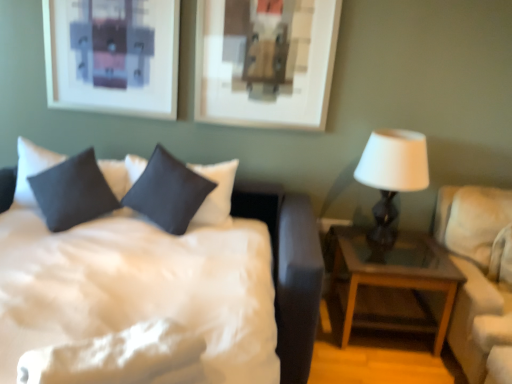
Question: Considering the relative positions of beige fabric couch at right and satin dark blue pillow at center, arranged as the 2th pillow when viewed from the left, in the image provided, is beige fabric couch at right to the left of satin dark blue pillow at center, arranged as the 2th pillow when viewed from the left, from the viewer's perspective?

Choices:
 (A) no
 (B) yes

Answer: (A)

Question: Is beige fabric couch at right closer to camera compared to satin dark blue pillow at center, arranged as the 2th pillow when viewed from the left?

Choices:
 (A) yes
 (B) no

Answer: (A)

Question: Could you tell me if beige fabric couch at right is turned towards satin dark blue pillow at center, arranged as the 2th pillow when viewed from the left?

Choices:
 (A) no
 (B) yes

Answer: (A)

Question: Can we say beige fabric couch at right lies outside satin dark blue pillow at center, placed as the 1th pillow when sorted from right to left?

Choices:
 (A) no
 (B) yes

Answer: (B)

Question: From the image's perspective, is beige fabric couch at right located above satin dark blue pillow at center, arranged as the 2th pillow when viewed from the left?

Choices:
 (A) no
 (B) yes

Answer: (A)

Question: Would you say dark gray fabric pillow at upper left, marked as the first pillow in a left-to-right arrangement, is to the left or to the right of white matte table lamp at right in the picture?

Choices:
 (A) left
 (B) right

Answer: (A)

Question: Based on their sizes in the image, would you say dark gray fabric pillow at upper left, marked as the first pillow in a left-to-right arrangement, is bigger or smaller than white matte table lamp at right?

Choices:
 (A) small
 (B) big

Answer: (B)

Question: Considering the positions of dark gray fabric pillow at upper left, marked as the first pillow in a left-to-right arrangement, and white matte table lamp at right in the image, is dark gray fabric pillow at upper left, marked as the first pillow in a left-to-right arrangement, taller or shorter than white matte table lamp at right?

Choices:
 (A) tall
 (B) short

Answer: (B)

Question: Is point (84, 180) closer or farther from the camera than point (382, 208)?

Choices:
 (A) farther
 (B) closer

Answer: (B)

Question: Would you say dark gray fabric pillow at upper left, which ranks as the second pillow in right-to-left order, is inside or outside satin dark blue pillow at center, arranged as the 2th pillow when viewed from the left?

Choices:
 (A) inside
 (B) outside

Answer: (B)

Question: Is point (106, 205) positioned closer to the camera than point (172, 220)?

Choices:
 (A) closer
 (B) farther

Answer: (B)

Question: Based on their positions, is dark gray fabric pillow at upper left, which ranks as the second pillow in right-to-left order, located to the left or right of satin dark blue pillow at center, arranged as the 2th pillow when viewed from the left?

Choices:
 (A) right
 (B) left

Answer: (B)

Question: Looking at their shapes, would you say dark gray fabric pillow at upper left, which ranks as the second pillow in right-to-left order, is wider or thinner than satin dark blue pillow at center, placed as the 1th pillow when sorted from right to left?

Choices:
 (A) thin
 (B) wide

Answer: (B)

Question: Relative to white satin bed at center, is satin dark blue pillow at center, placed as the 1th pillow when sorted from right to left, in front or behind?

Choices:
 (A) front
 (B) behind

Answer: (B)

Question: In terms of width, does satin dark blue pillow at center, arranged as the 2th pillow when viewed from the left, look wider or thinner when compared to white satin bed at center?

Choices:
 (A) thin
 (B) wide

Answer: (A)